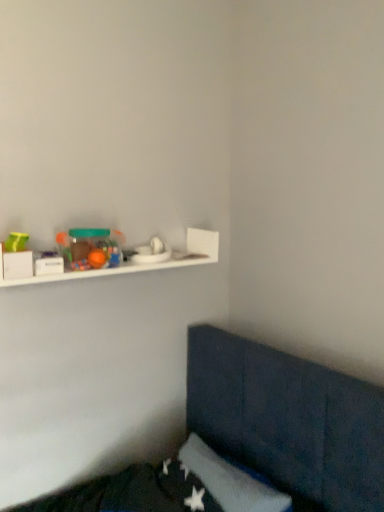
The height and width of the screenshot is (512, 384). I want to click on matte plastic container at upper left, so click(x=91, y=246).

This screenshot has width=384, height=512. Describe the element at coordinates (91, 246) in the screenshot. I see `matte plastic container at upper left` at that location.

Describe the element at coordinates (137, 264) in the screenshot. This screenshot has width=384, height=512. I see `white matte shelf at upper left` at that location.

Identify the location of white matte shelf at upper left. Image resolution: width=384 pixels, height=512 pixels. (137, 264).

Where is `matte plastic container at upper left`? This screenshot has height=512, width=384. matte plastic container at upper left is located at coordinates tap(91, 246).

Does matte plastic container at upper left appear on the left side of white matte shelf at upper left?

Yes, matte plastic container at upper left is to the left of white matte shelf at upper left.

In the image, is matte plastic container at upper left positioned in front of or behind white matte shelf at upper left?

matte plastic container at upper left is positioned farther from the viewer than white matte shelf at upper left.

Does point (63, 249) come closer to viewer compared to point (215, 233)?

Yes, point (63, 249) is closer to viewer.

From the image's perspective, which one is positioned lower, matte plastic container at upper left or white matte shelf at upper left?

white matte shelf at upper left, from the image's perspective.

From a real-world perspective, is matte plastic container at upper left positioned above or below white matte shelf at upper left?

From a real-world perspective, matte plastic container at upper left is physically above white matte shelf at upper left.

Looking at their sizes, would you say matte plastic container at upper left is wider or thinner than white matte shelf at upper left?

Considering their sizes, matte plastic container at upper left looks slimmer than white matte shelf at upper left.

Considering the sizes of objects matte plastic container at upper left and white matte shelf at upper left in the image provided, who is shorter, matte plastic container at upper left or white matte shelf at upper left?

matte plastic container at upper left is shorter.

Consider the image. Does matte plastic container at upper left have a smaller size compared to white matte shelf at upper left?

Yes.

Would you say matte plastic container at upper left is inside or outside white matte shelf at upper left?

matte plastic container at upper left exists entirely within white matte shelf at upper left.

Would you say matte plastic container at upper left is a long distance from white matte shelf at upper left?

No, there isn't a large distance between matte plastic container at upper left and white matte shelf at upper left.

Consider the image. Is matte plastic container at upper left looking in the opposite direction of white matte shelf at upper left?

Yes, matte plastic container at upper left is positioned with its back facing white matte shelf at upper left.

Locate an element on the screen. This screenshot has width=384, height=512. toy lying above the white matte shelf at upper left (from the image's perspective) is located at coordinates (91, 246).

Considering the positions of objects white matte shelf at upper left and matte plastic container at upper left in the image provided, who is more to the left, white matte shelf at upper left or matte plastic container at upper left?

matte plastic container at upper left is more to the left.

Consider the image. Which object is closer to the camera taking this photo, white matte shelf at upper left or matte plastic container at upper left?

white matte shelf at upper left is in front.

Does point (77, 271) come farther from viewer compared to point (91, 231)?

No.

From the image's perspective, which object appears higher, white matte shelf at upper left or matte plastic container at upper left?

From the image's view, matte plastic container at upper left is above.

From a real-world perspective, is white matte shelf at upper left on top of matte plastic container at upper left?

No, from a real-world perspective, white matte shelf at upper left is not on top of matte plastic container at upper left.

Can you confirm if white matte shelf at upper left is wider than matte plastic container at upper left?

Yes.

Is white matte shelf at upper left taller than matte plastic container at upper left?

Yes, white matte shelf at upper left is taller than matte plastic container at upper left.

Does white matte shelf at upper left have a smaller size compared to matte plastic container at upper left?

No.

Do you think white matte shelf at upper left is within matte plastic container at upper left, or outside of it?

white matte shelf at upper left is not enclosed by matte plastic container at upper left.

Is white matte shelf at upper left far from matte plastic container at upper left?

white matte shelf at upper left is near matte plastic container at upper left, not far away.

Is white matte shelf at upper left looking in the opposite direction of matte plastic container at upper left?

Yes, white matte shelf at upper left's orientation is away from matte plastic container at upper left.

What's the angular difference between white matte shelf at upper left and matte plastic container at upper left's facing directions?

The angle between the facing direction of white matte shelf at upper left and the facing direction of matte plastic container at upper left is 0.00244 degrees.

Identify the location of toy above the white matte shelf at upper left (from a real-world perspective). (91, 246).

The width and height of the screenshot is (384, 512). I want to click on toy above the white matte shelf at upper left (from the image's perspective), so click(x=91, y=246).

Identify the location of shelf to the right of matte plastic container at upper left. (137, 264).